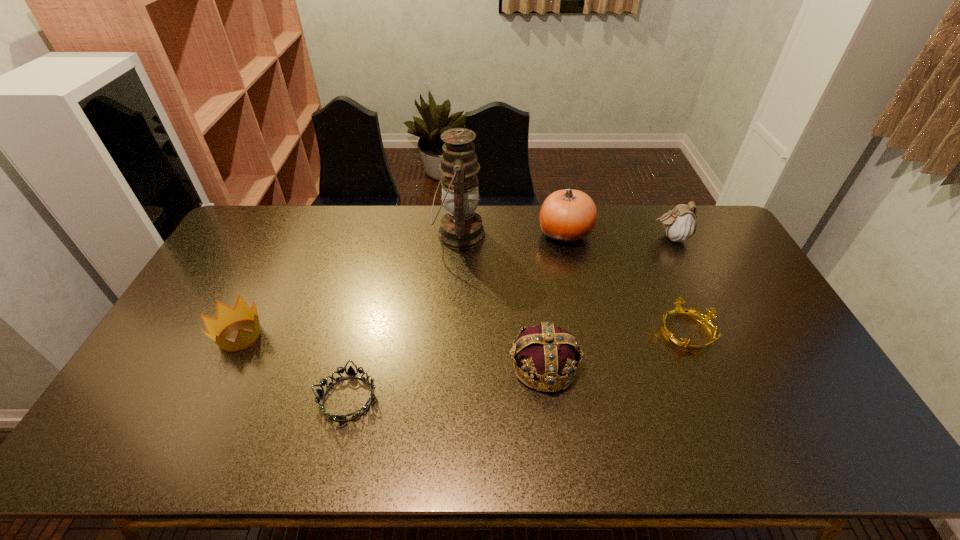
Locate an element on the screen. This screenshot has height=540, width=960. the fifth object from right to left is located at coordinates (461, 228).

Identify the location of the tallest object. The image size is (960, 540). (461, 228).

Locate an element on the screen. the second tallest object is located at coordinates (567, 216).

Locate an element on the screen. The width and height of the screenshot is (960, 540). pouch is located at coordinates (680, 224).

Identify the location of the second crown from right to left. This screenshot has height=540, width=960. (546, 352).

Where is `the second tallest crown`? The image size is (960, 540). the second tallest crown is located at coordinates (225, 315).

Locate an element on the screen. the leftmost object is located at coordinates (225, 315).

The image size is (960, 540). Identify the location of the shortest crown. (678, 311).

Locate an element on the screen. tiara is located at coordinates (350, 373).

Identify the location of free space located 0.300m on the left of the fifth object from right to left. The width and height of the screenshot is (960, 540). (350, 235).